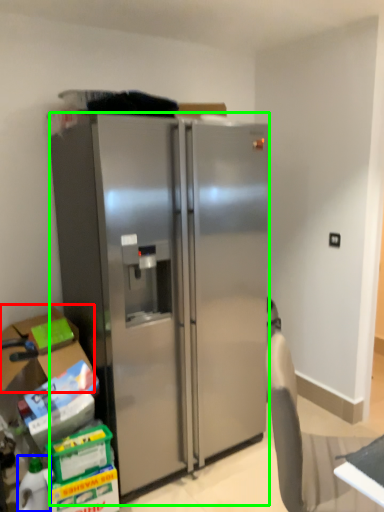
Question: Based on their relative distances, which object is nearer to box (highlighted by a red box)? Choose from bottle (highlighted by a blue box) and refrigerator (highlighted by a green box).

Choices:
 (A) bottle
 (B) refrigerator

Answer: (A)